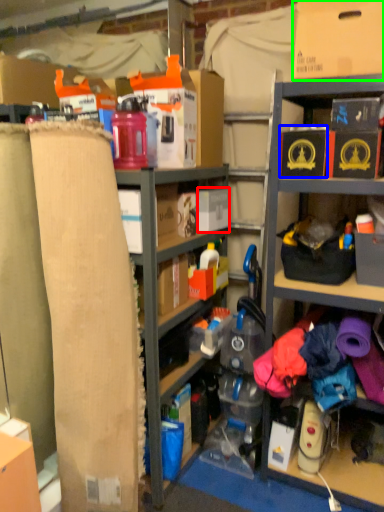
Question: Which object is positioned closest to storage box (highlighted by a red box)? Select from storage box (highlighted by a blue box) and cardboard box (highlighted by a green box).

Choices:
 (A) storage box
 (B) cardboard box

Answer: (A)